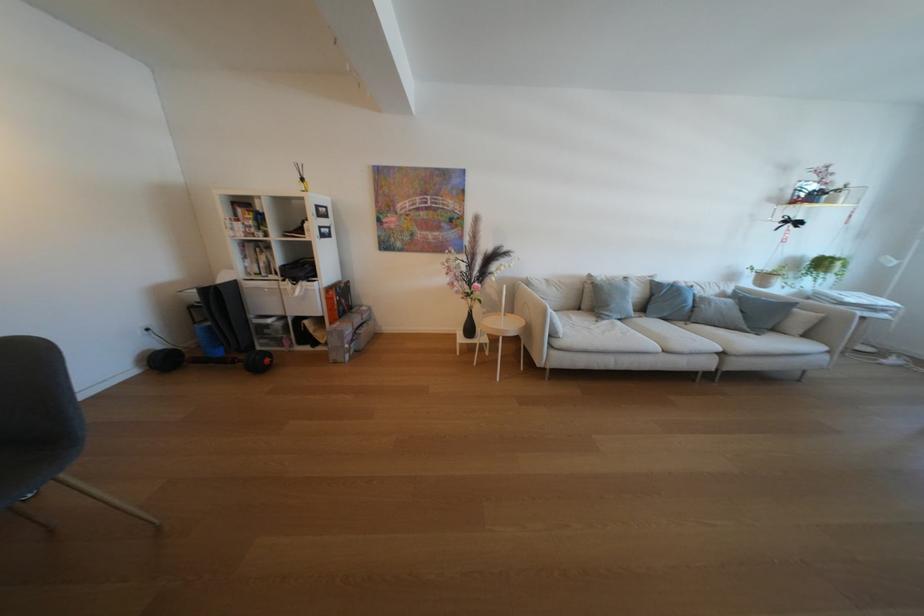
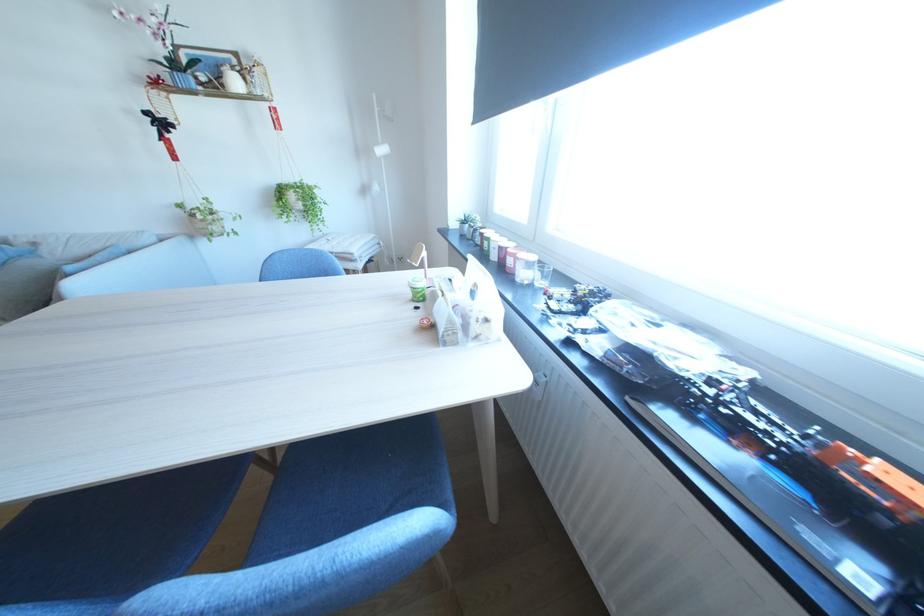
The point at (843, 264) is marked in the first image. Where is the corresponding point in the second image?

(295, 196)